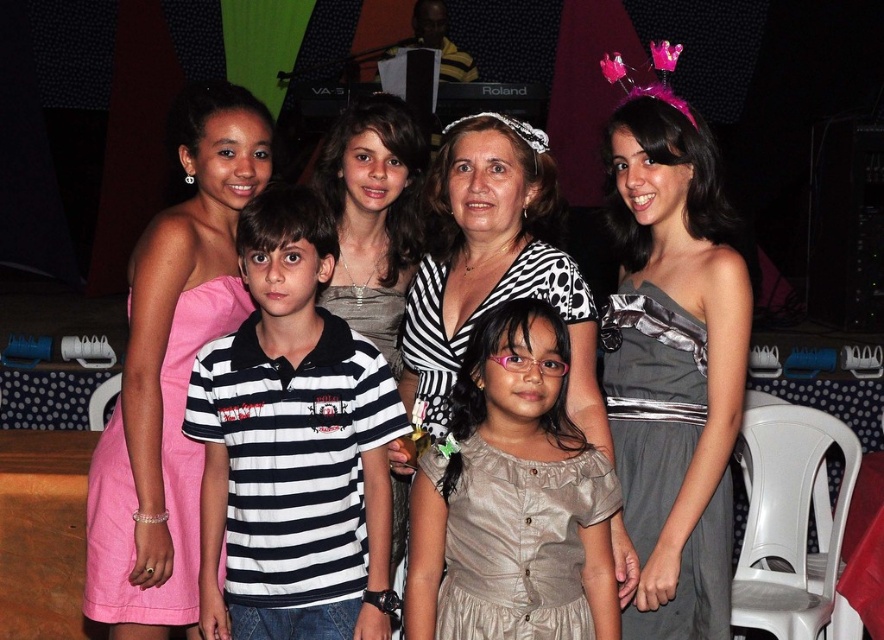
Question: Which point is farther to the camera?

Choices:
 (A) (97, 509)
 (B) (347, 273)
 (C) (370, 586)
 (D) (540, 145)

Answer: (B)

Question: Which point is farther from the camera taking this photo?

Choices:
 (A) (256, 269)
 (B) (206, 304)
 (C) (387, 138)

Answer: (C)

Question: Does satin gray dress at lower right have a greater width compared to pink satin dress at left?

Choices:
 (A) no
 (B) yes

Answer: (A)

Question: Is black striped shirt at center wider than satin gray dress at lower right?

Choices:
 (A) no
 (B) yes

Answer: (B)

Question: Which of the following is the closest to the observer?

Choices:
 (A) (714, 497)
 (B) (697, 392)
 (C) (189, 509)

Answer: (A)

Question: Is matte black dress at upper left behind matte silver dress at center?

Choices:
 (A) yes
 (B) no

Answer: (B)